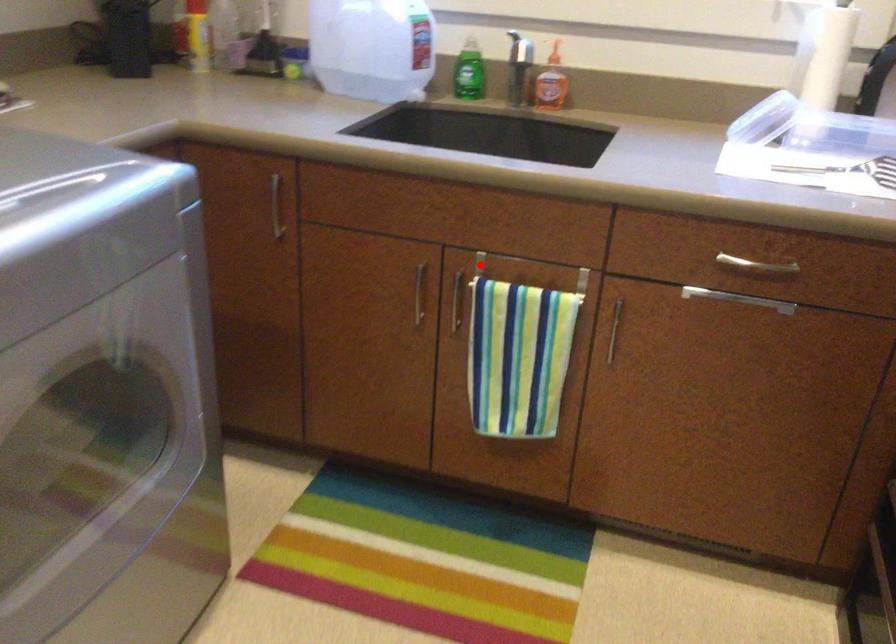
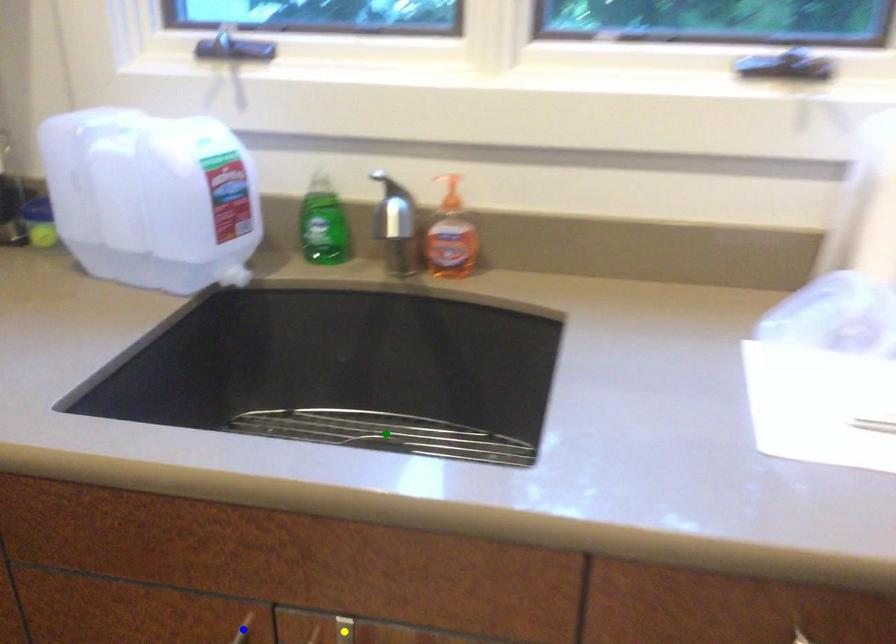
Question: I am providing you with two images of the same scene from different viewpoints. A red point is marked on the first image. You are given multiple points on the second image. Which spot in image 2 lines up with the point in image 1?

Choices:
 (A) blue point
 (B) green point
 (C) yellow point

Answer: (C)